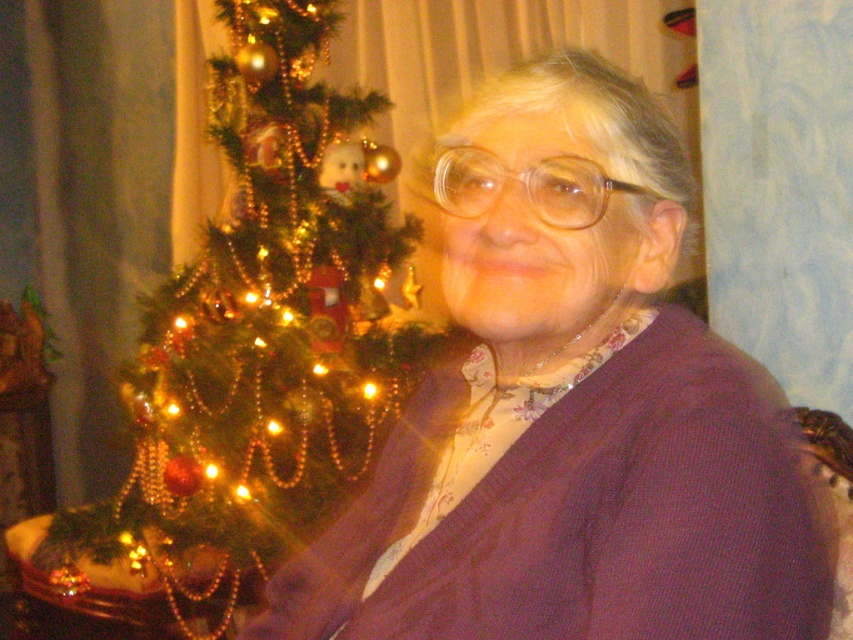
You are standing in front of the Christmas tree and want to place a decoration at the point marked as point (631,268). If your arm can reach up to 36 inches, will you be able to reach that point?

The point (631,268) is 35.40 inches away from the viewer, which is within the reach of your 36 inches arm length. Therefore, you can reach that point.

You are an interior designer assessing the spatial arrangement of the living room. You see the purple knitted sweater at center and the green textured christmas tree at left. Which object occupies more horizontal space in the scene?

The green textured christmas tree at left occupies more horizontal space than the purple knitted sweater at center because the sweater has a lesser width compared to the tree.

You are organizing a Christmas photo shoot and need to ensure that the purple knitted sweater at center and the green textured christmas tree at left are both visible in the frame. Based on their sizes, which object should you prioritize positioning closer to the camera to ensure both are clearly visible?

The purple knitted sweater at center is smaller than the green textured christmas tree at left, so you should prioritize positioning the purple knitted sweater at center closer to the camera to ensure both are clearly visible.